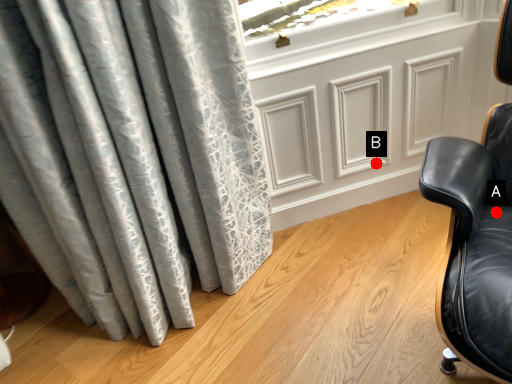
Question: Two points are circled on the image, labeled by A and B beside each circle. Which point appears closest to the camera in this image?

Choices:
 (A) A is closer
 (B) B is closer

Answer: (A)